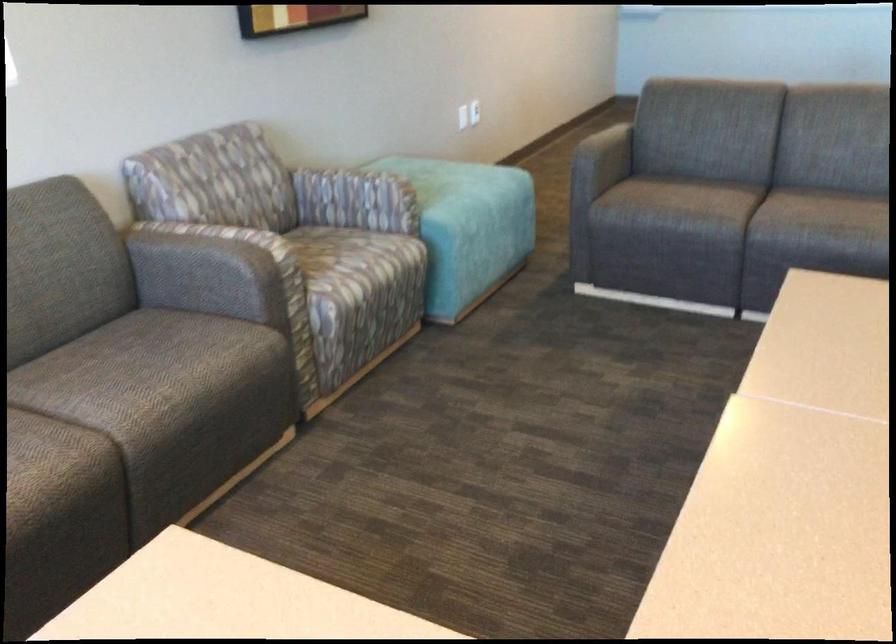
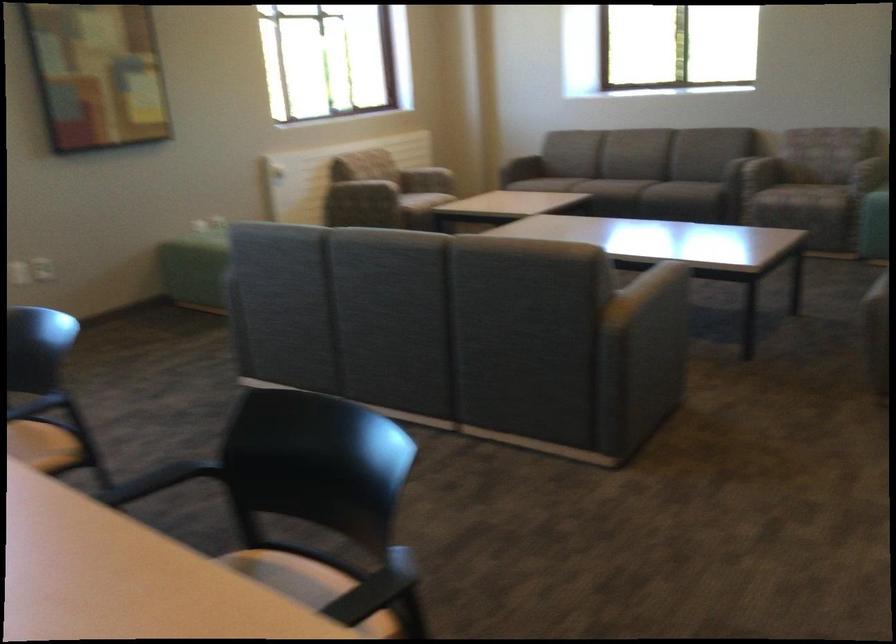
Find the pixel in the second image that matches pixel 436 236 in the first image.

(807, 184)